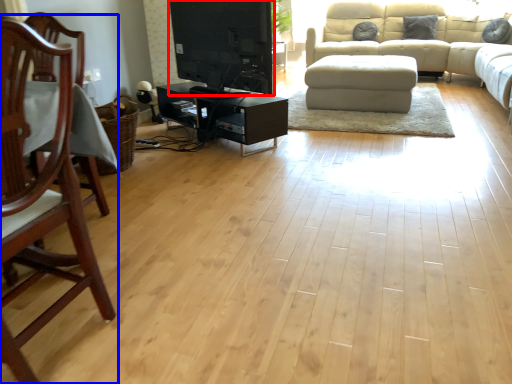
Question: Which object appears closest to the camera in this image, entertainment center (highlighted by a red box) or chair (highlighted by a blue box)?

Choices:
 (A) entertainment center
 (B) chair

Answer: (B)